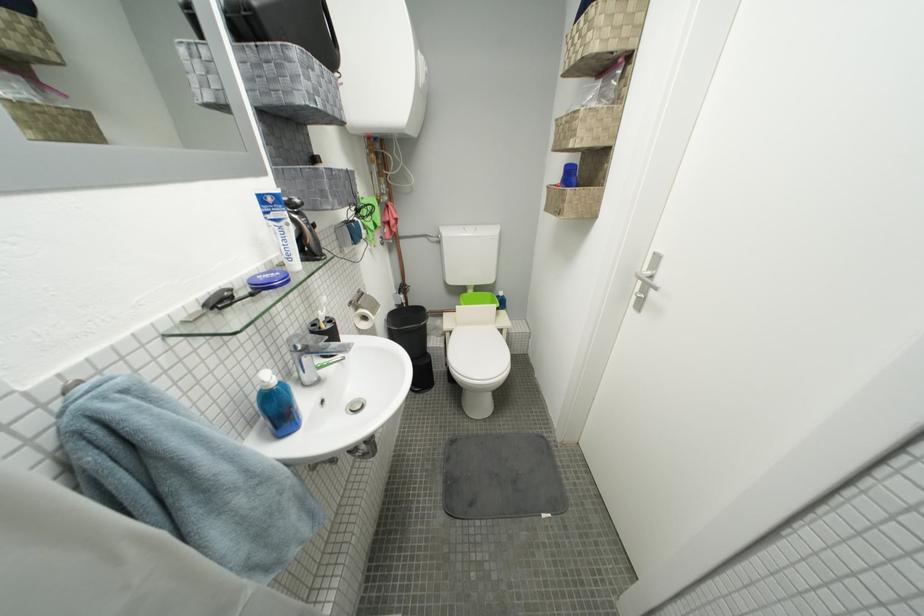
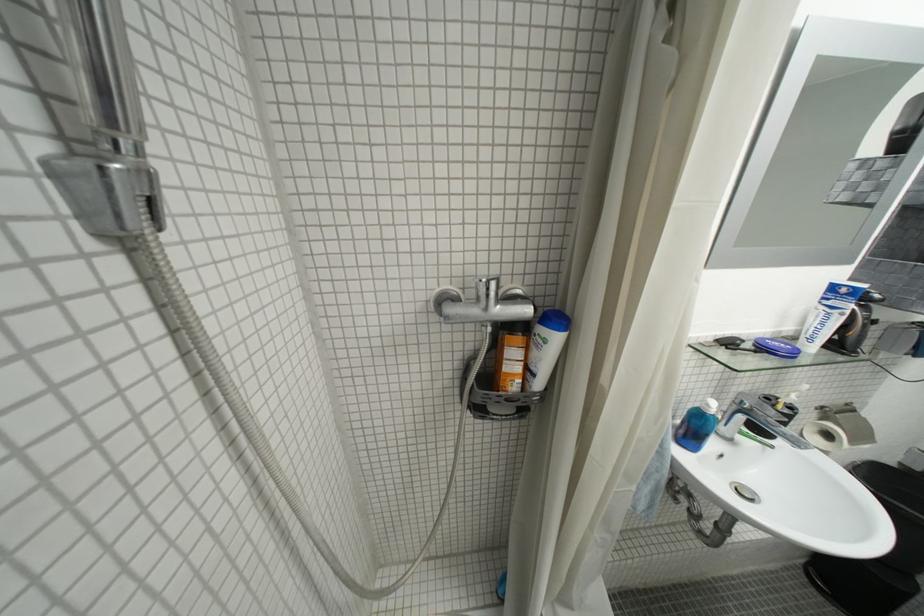
Find the pixel in the second image that matches pixel 275 216 in the first image.

(833, 301)